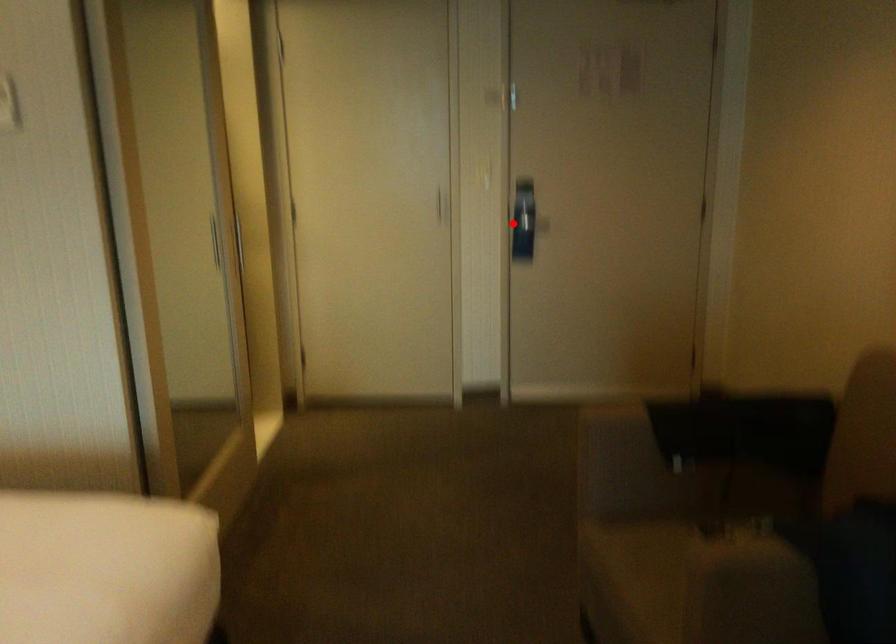
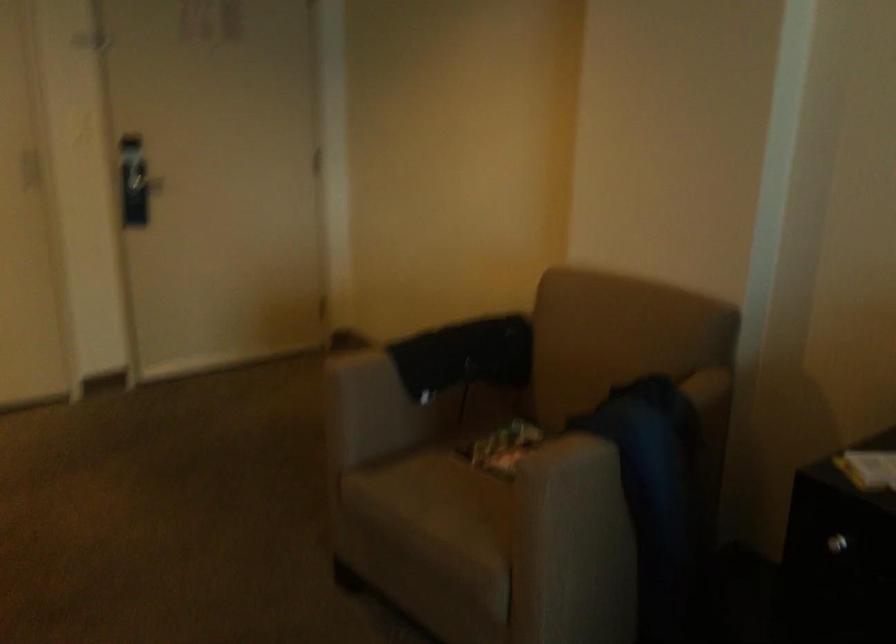
Question: I am providing you with two images of the same scene from different viewpoints. Image1 has a red point marked. In image2, the corresponding 3D location appears at what relative position? Reply with the corresponding letter.

Choices:
 (A) Closer
 (B) Farther

Answer: (A)